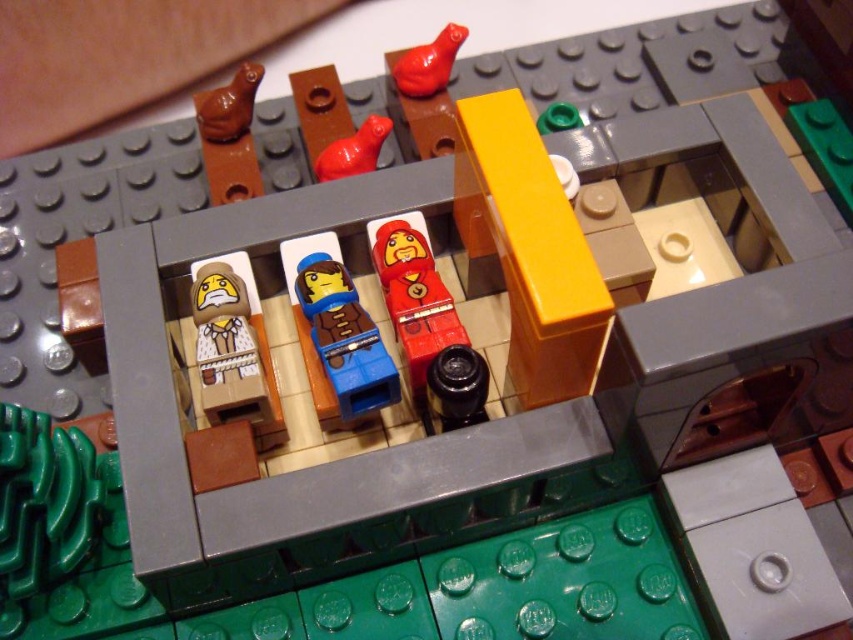
Can you confirm if brown matte minifigure at center-left is positioned to the left of matte red bird at upper center?

Correct, you'll find brown matte minifigure at center-left to the left of matte red bird at upper center.

Is brown matte minifigure at center-left bigger than matte red bird at upper center?

Yes.

Identify the location of brown matte minifigure at center-left. (234, 349).

Locate an element on the screen. This screenshot has height=640, width=853. brown matte minifigure at center-left is located at coordinates (234, 349).

At what (x,y) coordinates should I click in order to perform the action: click on matte red bird at upper center. Please return your answer as a coordinate pair (x, y). Looking at the image, I should click on (428, 64).

Measure the distance between matte red bird at upper center and rubber duck at center.

5.23 inches

You are a GUI agent. You are given a task and a screenshot of the screen. Output one action in this format:
    pyautogui.click(x=<x>, y=<y>)
    Task: Click on the matte red bird at upper center
    This screenshot has width=853, height=640.
    Given the screenshot: What is the action you would take?
    pyautogui.click(x=428, y=64)

Identify the location of matte red bird at upper center. This screenshot has height=640, width=853. (428, 64).

Who is positioned more to the right, blue plastic figure at center or rubber duck at center?

rubber duck at center

Measure the distance between blue plastic figure at center and camera.

blue plastic figure at center and camera are 77.78 centimeters apart from each other.

Find the location of a particular element. blue plastic figure at center is located at coordinates (x=343, y=339).